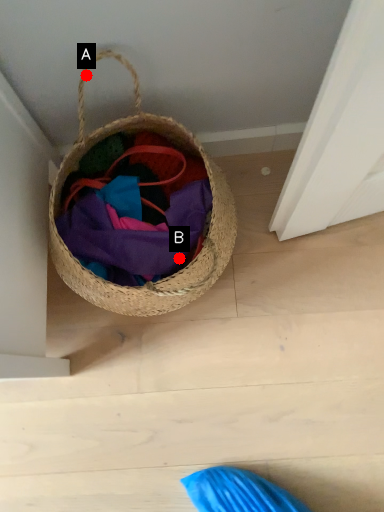
Question: Two points are circled on the image, labeled by A and B beside each circle. Which point is farther to the camera?

Choices:
 (A) A is further
 (B) B is further

Answer: (B)